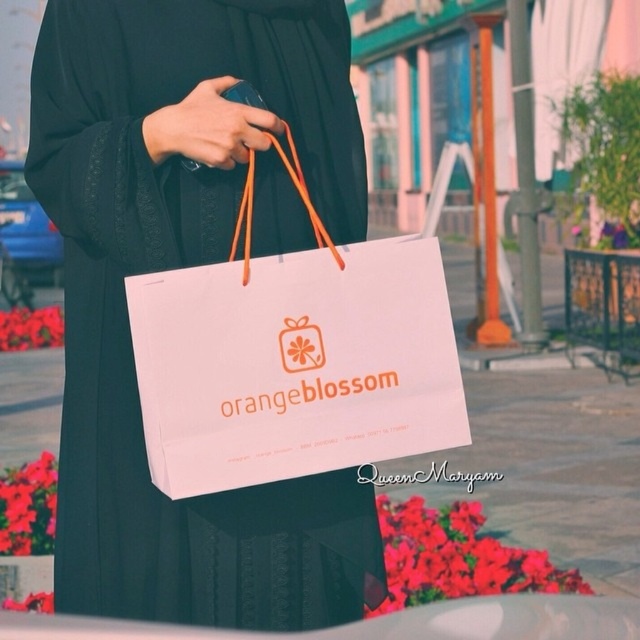
Does black matte robe at center appear on the right side of white paper bag at center?

Incorrect, black matte robe at center is not on the right side of white paper bag at center.

Does black matte robe at center have a larger size compared to white paper bag at center?

Yes.

Between point (136, 564) and point (368, 397), which one is positioned behind?

Point (136, 564)

Locate an element on the screen. black matte robe at center is located at coordinates (186, 266).